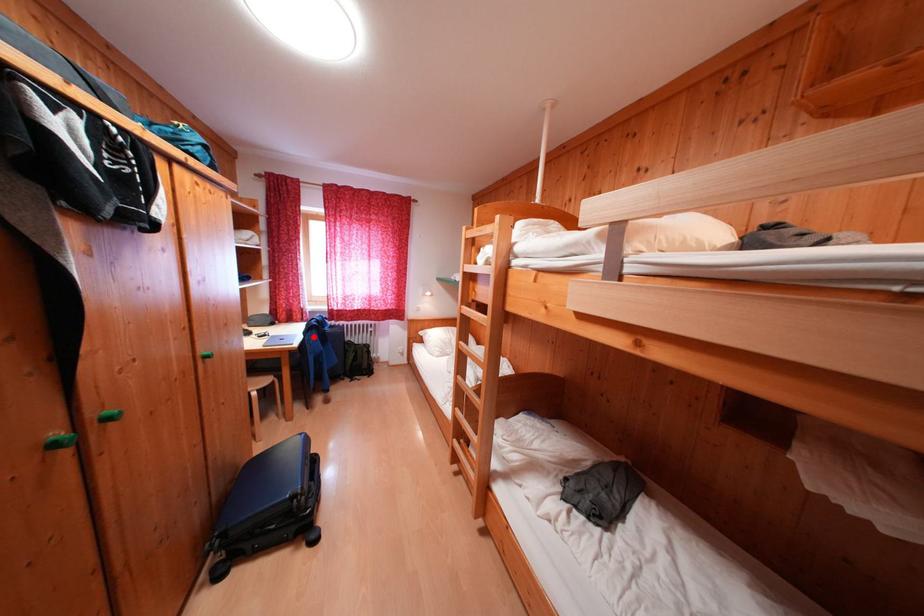
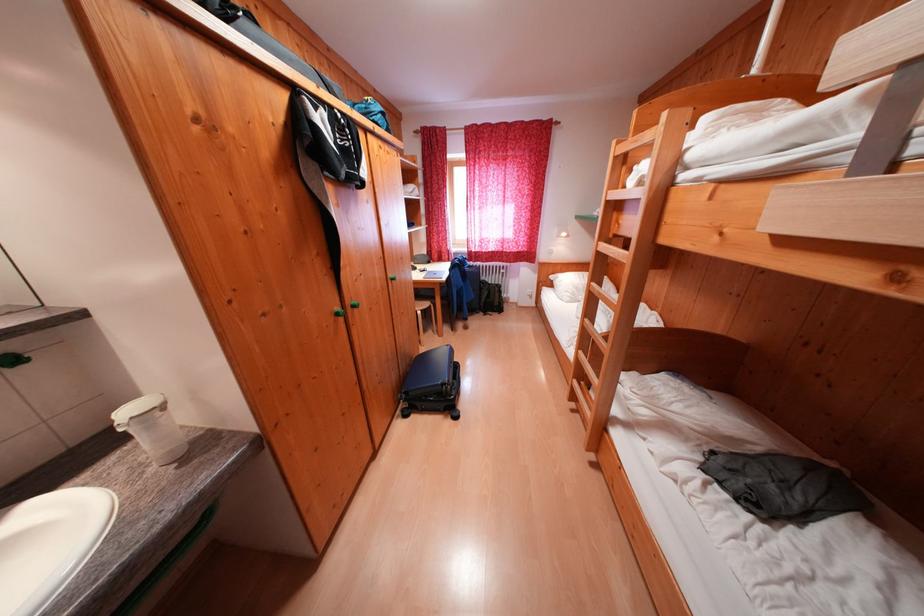
In the second image, find the point that corresponds to the highlighted location in the first image.

(458, 274)